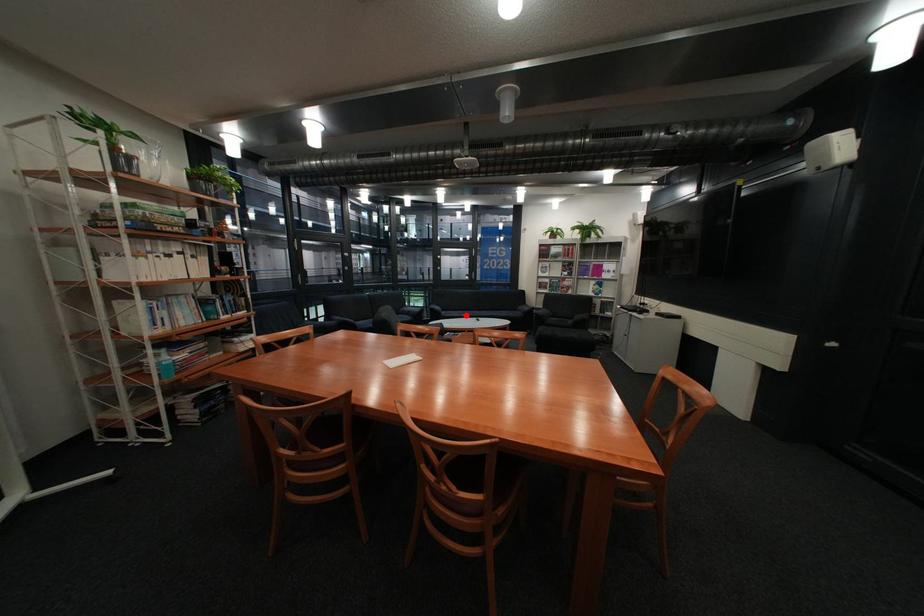
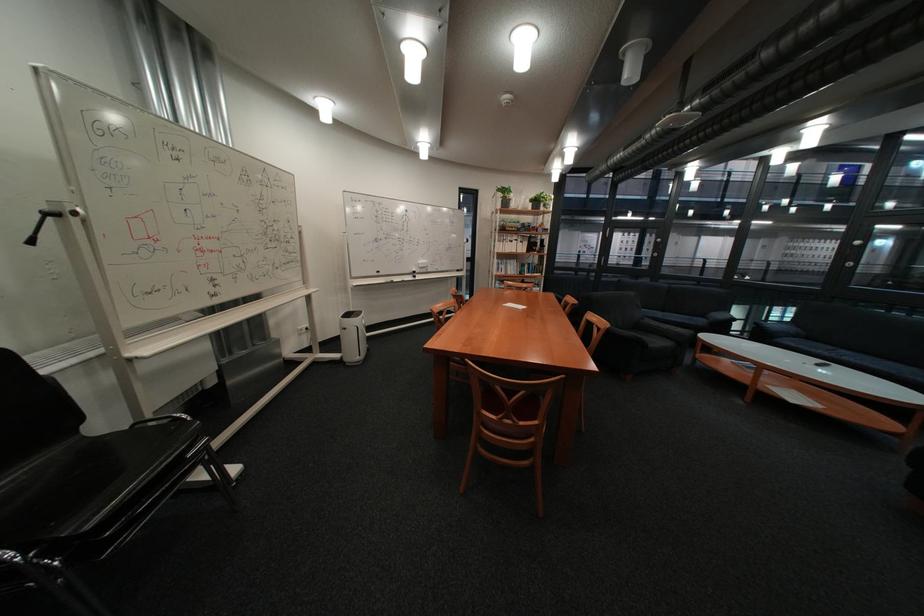
Where in the second image is the point corresponding to the highlighted location from the first image?

(808, 345)